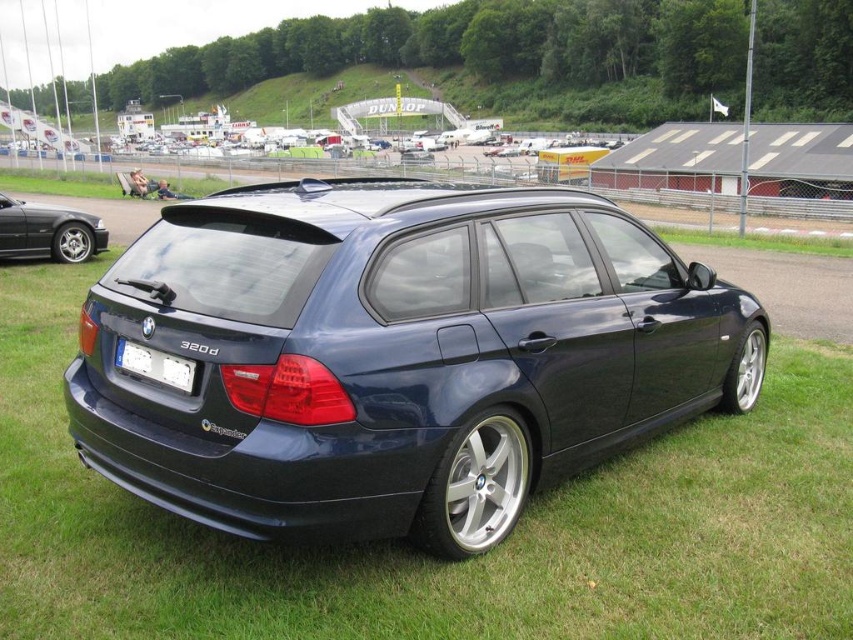
Question: Estimate the real-world distances between objects in this image. Which object is farther from the white plastic license plate at center?

Choices:
 (A) shiny black car at left
 (B) matte black car at center

Answer: (B)

Question: Is satin dark blue wagon at center above shiny black car at left?

Choices:
 (A) no
 (B) yes

Answer: (A)

Question: Can you confirm if satin dark blue wagon at center is positioned above white plastic license plate at center?

Choices:
 (A) no
 (B) yes

Answer: (B)

Question: Can you confirm if shiny black car at left is wider than white plastic license plate at center?

Choices:
 (A) no
 (B) yes

Answer: (B)

Question: Which point appears farthest from the camera in this image?

Choices:
 (A) (146, 371)
 (B) (49, 205)

Answer: (B)

Question: Which is nearer to the satin dark blue wagon at center?

Choices:
 (A) shiny black car at left
 (B) white plastic license plate at center
 (C) matte black car at center

Answer: (B)